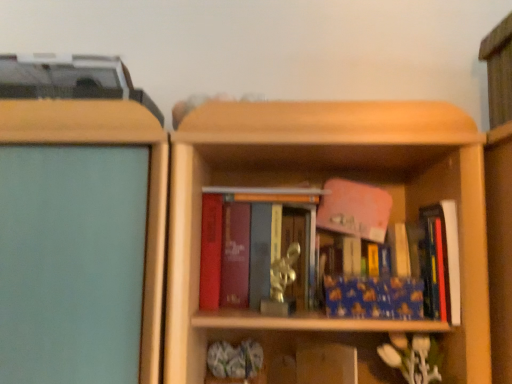
Consider the image. Measure the distance between matte red book at center, which is counted as the 3th book, starting from the right, and camera.

matte red book at center, which is counted as the 3th book, starting from the right, is 91.10 centimeters from camera.

This screenshot has height=384, width=512. Describe the element at coordinates (449, 253) in the screenshot. I see `blue matte book at right, the third book in the left-to-right sequence` at that location.

The width and height of the screenshot is (512, 384). Find the location of `blue matte book at center, the 2th book positioned from the left`. blue matte book at center, the 2th book positioned from the left is located at coordinates (373, 297).

I want to click on book above the blue matte book at right, marked as the 1th book in a right-to-left arrangement (from the image's perspective), so click(258, 248).

From a real-world perspective, does matte red book at center, which is the first book in left-to-right order, stand above blue matte book at right, marked as the 1th book in a right-to-left arrangement?

Yes, from a real-world perspective, matte red book at center, which is the first book in left-to-right order, is on top of blue matte book at right, marked as the 1th book in a right-to-left arrangement.

Is matte red book at center, which is counted as the 3th book, starting from the right, closer to the viewer compared to blue matte book at right, marked as the 1th book in a right-to-left arrangement?

No, matte red book at center, which is counted as the 3th book, starting from the right, is further to the viewer.

Does matte red book at center, which is counted as the 3th book, starting from the right, have a lesser width compared to blue matte book at right, the third book in the left-to-right sequence?

Yes, matte red book at center, which is counted as the 3th book, starting from the right, is thinner than blue matte book at right, the third book in the left-to-right sequence.

Could you tell me if matte red book at center, which is counted as the 3th book, starting from the right, is turned towards blue matte book at center, which appears as the second book when viewed from the right?

No, matte red book at center, which is counted as the 3th book, starting from the right, is not facing towards blue matte book at center, which appears as the second book when viewed from the right.

Between matte red book at center, which is the first book in left-to-right order, and blue matte book at center, which appears as the second book when viewed from the right, which one is positioned behind?

matte red book at center, which is the first book in left-to-right order, is behind.

Is the surface of matte red book at center, which is counted as the 3th book, starting from the right, in direct contact with blue matte book at center, which appears as the second book when viewed from the right?

No, matte red book at center, which is counted as the 3th book, starting from the right, is not touching blue matte book at center, which appears as the second book when viewed from the right.

From a real-world perspective, is blue matte book at right, the third book in the left-to-right sequence, above or below matte red book at center, which is counted as the 3th book, starting from the right?

Clearly, from a real-world perspective, blue matte book at right, the third book in the left-to-right sequence, is below matte red book at center, which is counted as the 3th book, starting from the right.

How many degrees apart are the facing directions of blue matte book at right, the third book in the left-to-right sequence, and matte red book at center, which is the first book in left-to-right order?

They differ by 7.52 degrees in their facing directions.

Could you measure the distance between blue matte book at right, the third book in the left-to-right sequence, and matte red book at center, which is counted as the 3th book, starting from the right?

blue matte book at right, the third book in the left-to-right sequence, is 14.51 inches away from matte red book at center, which is counted as the 3th book, starting from the right.

Looking at this image, between blue matte book at right, marked as the 1th book in a right-to-left arrangement, and matte red book at center, which is the first book in left-to-right order, which one appears on the left side from the viewer's perspective?

Positioned to the left is matte red book at center, which is the first book in left-to-right order.

From a real-world perspective, between blue matte book at center, which appears as the second book when viewed from the right, and blue matte book at right, the third book in the left-to-right sequence, who is vertically higher?

blue matte book at right, the third book in the left-to-right sequence.

Can you tell me how much blue matte book at center, which appears as the second book when viewed from the right, and blue matte book at right, marked as the 1th book in a right-to-left arrangement, differ in facing direction?

The angular difference between blue matte book at center, which appears as the second book when viewed from the right, and blue matte book at right, marked as the 1th book in a right-to-left arrangement, is 0.789 degrees.

From the picture: Does blue matte book at center, the 2th book positioned from the left, come behind blue matte book at right, the third book in the left-to-right sequence?

That is True.

Considering the sizes of objects blue matte book at center, the 2th book positioned from the left, and blue matte book at right, the third book in the left-to-right sequence, in the image provided, who is bigger, blue matte book at center, the 2th book positioned from the left, or blue matte book at right, the third book in the left-to-right sequence,?

Bigger between the two is blue matte book at right, the third book in the left-to-right sequence.

Is blue matte book at right, marked as the 1th book in a right-to-left arrangement, bigger than blue matte book at center, which appears as the second book when viewed from the right?

Yes.

From the image's perspective, between blue matte book at right, marked as the 1th book in a right-to-left arrangement, and blue matte book at center, the 2th book positioned from the left, who is located below?

From the image's view, blue matte book at center, the 2th book positioned from the left, is below.

Would you say blue matte book at right, the third book in the left-to-right sequence, is to the left or to the right of blue matte book at center, the 2th book positioned from the left, in the picture?

From the image, it's evident that blue matte book at right, the third book in the left-to-right sequence, is to the right of blue matte book at center, the 2th book positioned from the left.

Is blue matte book at right, marked as the 1th book in a right-to-left arrangement, positioned with its back to blue matte book at center, the 2th book positioned from the left?

No, blue matte book at right, marked as the 1th book in a right-to-left arrangement, is not facing away from blue matte book at center, the 2th book positioned from the left.

Locate an element on the screen. book to the left of blue matte book at center, the 2th book positioned from the left is located at coordinates (258, 248).

Could matte red book at center, which is the first book in left-to-right order, be considered to be inside blue matte book at center, the 2th book positioned from the left?

No, matte red book at center, which is the first book in left-to-right order, is not inside blue matte book at center, the 2th book positioned from the left.

Could you tell me if blue matte book at center, the 2th book positioned from the left, is facing matte red book at center, which is counted as the 3th book, starting from the right?

No, blue matte book at center, the 2th book positioned from the left, is not oriented towards matte red book at center, which is counted as the 3th book, starting from the right.

Between blue matte book at center, the 2th book positioned from the left, and matte red book at center, which is counted as the 3th book, starting from the right, which one has smaller size?

blue matte book at center, the 2th book positioned from the left, is smaller.

This screenshot has height=384, width=512. Identify the location of the 2nd book behind the blue matte book at right, the third book in the left-to-right sequence. (258, 248).

Locate an element on the screen. This screenshot has width=512, height=384. book that is on the left side of blue matte book at center, the 2th book positioned from the left is located at coordinates (258, 248).

When comparing their distances from matte red book at center, which is the first book in left-to-right order, does blue matte book at right, marked as the 1th book in a right-to-left arrangement, or blue matte book at center, the 2th book positioned from the left, seem closer?

Among the two, blue matte book at center, the 2th book positioned from the left, is located nearer to matte red book at center, which is the first book in left-to-right order.

Looking at the image, which one is located closer to blue matte book at right, the third book in the left-to-right sequence, matte red book at center, which is the first book in left-to-right order, or blue matte book at center, the 2th book positioned from the left?

Among the two, blue matte book at center, the 2th book positioned from the left, is located nearer to blue matte book at right, the third book in the left-to-right sequence.

Looking at this image, estimate the real-world distances between objects in this image. Which object is closer to blue matte book at right, marked as the 1th book in a right-to-left arrangement, blue matte book at center, which appears as the second book when viewed from the right, or matte red book at center, which is counted as the 3th book, starting from the right?

Based on the image, blue matte book at center, which appears as the second book when viewed from the right, appears to be nearer to blue matte book at right, marked as the 1th book in a right-to-left arrangement.

Consider the image. When comparing their distances from blue matte book at center, the 2th book positioned from the left, does matte red book at center, which is counted as the 3th book, starting from the right, or blue matte book at right, marked as the 1th book in a right-to-left arrangement, seem further?

matte red book at center, which is counted as the 3th book, starting from the right, lies further to blue matte book at center, the 2th book positioned from the left, than the other object.

In the scene shown: When comparing their distances from matte red book at center, which is the first book in left-to-right order, does blue matte book at center, which appears as the second book when viewed from the right, or blue matte book at right, marked as the 1th book in a right-to-left arrangement, seem closer?

Based on the image, blue matte book at center, which appears as the second book when viewed from the right, appears to be nearer to matte red book at center, which is the first book in left-to-right order.

Considering their positions, is blue matte book at right, marked as the 1th book in a right-to-left arrangement, positioned further to blue matte book at center, the 2th book positioned from the left, than matte red book at center, which is the first book in left-to-right order?

matte red book at center, which is the first book in left-to-right order, is positioned further to the anchor blue matte book at center, the 2th book positioned from the left.

Identify the location of book between matte red book at center, which is the first book in left-to-right order, and blue matte book at right, the third book in the left-to-right sequence. (373, 297).